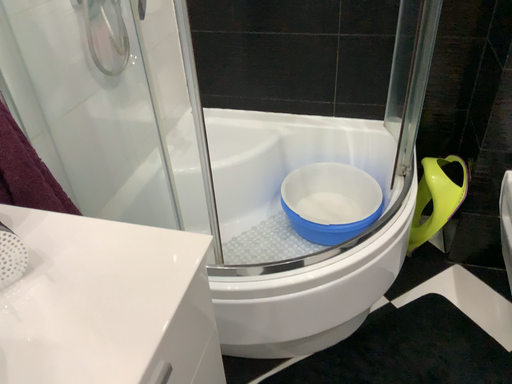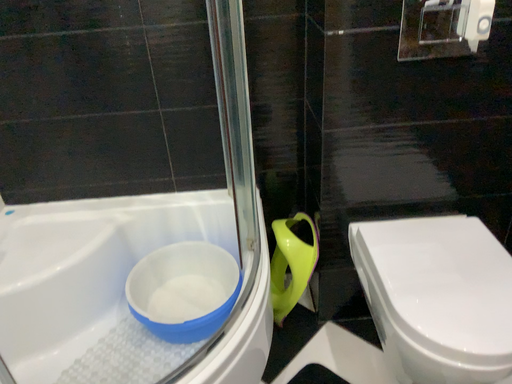
Question: Which way did the camera rotate in the video?

Choices:
 (A) rotated left
 (B) rotated right

Answer: (B)